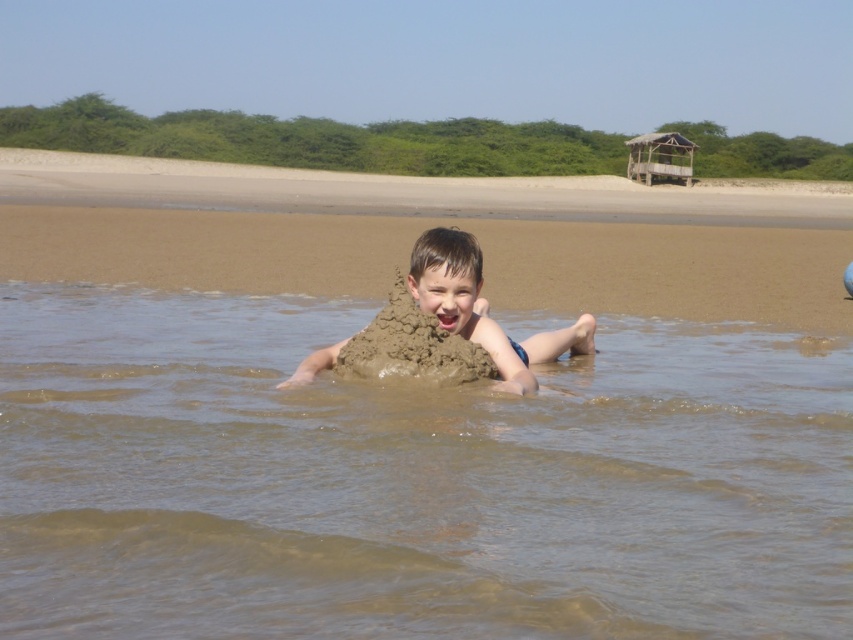
You are a child playing on the beach and want to build a sandcastle. You see the brown sandcastle at center and the brown sandy mud at center. Which location should you choose to build your sandcastle?

You should build your sandcastle at the brown sandcastle at center because it is to the right of the brown sandy mud at center, indicating it is a better spot for building.

Looking at this image, you are a beachgoer trying to build a sandcastle. You see the brown wet sand at center and the brown sandcastle at center. Which area has more space available for building a larger sandcastle?

The brown sandcastle at center has more space available for building a larger sandcastle since it has a greater width than the brown wet sand at center.

Based on the photo, you are a photographer standing at the edge of the beach. You want to take a photo that includes both the brown wet sand at center and the brown sandcastle at center. Which object should you focus on first to ensure both are in sharp focus?

You should focus on the brown sandcastle at center first because it is farther away from the viewer than the brown wet sand at center, ensuring both are in focus when using depth of field properly.